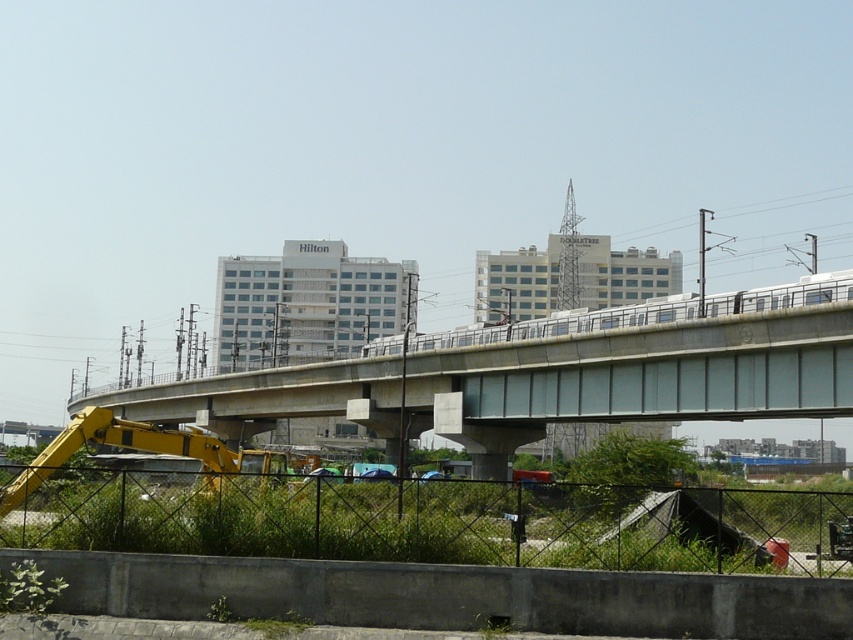
You are a city planner assessing the safety of the elevated railway. You need to ensure that the distance between the concrete at center and the silver metallic train at center is sufficient for safety regulations. The minimum required distance is 10 meters. Is the current distance compliant with the safety standards?

The concrete at center and silver metallic train at center are 9.65 meters apart from each other, which is less than the required 10 meters. Therefore, the current distance does not comply with safety standards.

You are a pedestrian standing on the grassy area below the elevated railway bridge. You see the concrete at center and the silver metallic train at center. Which object is closer to your right side?

The silver metallic train at center is closer to your right side because the concrete at center is to the left of it, meaning the train is positioned to the right relative to the concrete.

You are a city planner analyzing the urban layout. The concrete at center and the silver metallic train at center are both visible on the elevated railway bridge. Which of these two objects occupies a greater horizontal space on the bridge?

The concrete at center has a larger width than the silver metallic train at center, so it occupies more horizontal space on the bridge.